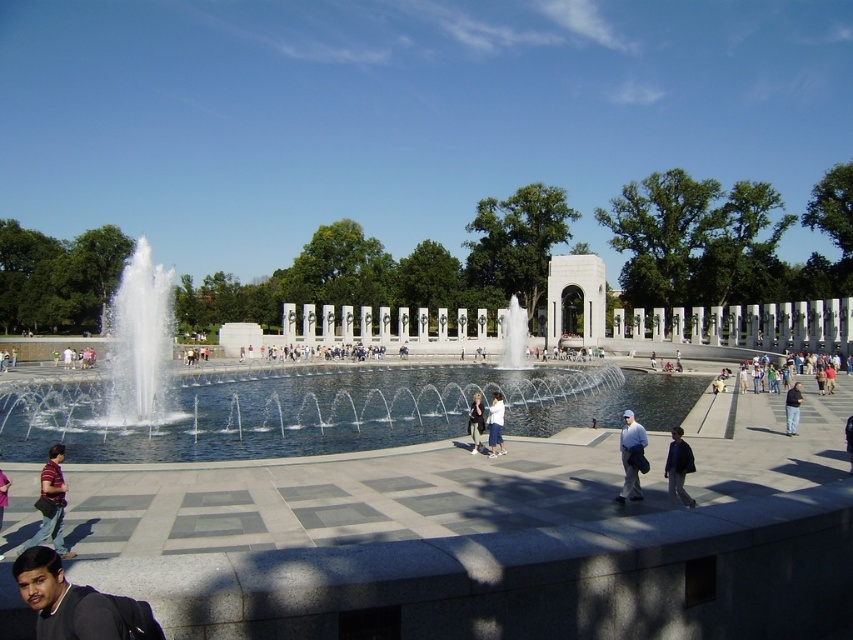
You are standing at the center of the fountain in the park. You see a dark gray sweater at lower left. Where is the dark gray sweater located relative to your position?

The dark gray sweater at lower left is located at point 0.944 on the x axis and 0.091 on the y axis relative to your position at the center of the fountain.

You are standing in the park and see the dark gray sweater at lower left and the dark blue jeans at center. Which item is nearer to you?

The dark gray sweater at lower left is closer to the viewer than the dark blue jeans at center.

You are standing at the center of the fountain in the park and want to find the dark gray sweater at lower left. Which direction should you move to locate it?

The dark gray sweater at lower left is located at point 0.944 on the x axis and 0.091 on the y axis. Since the coordinates are based on a 2D plane where lower left is the origin, moving towards the lower left direction would lead you to the sweater.